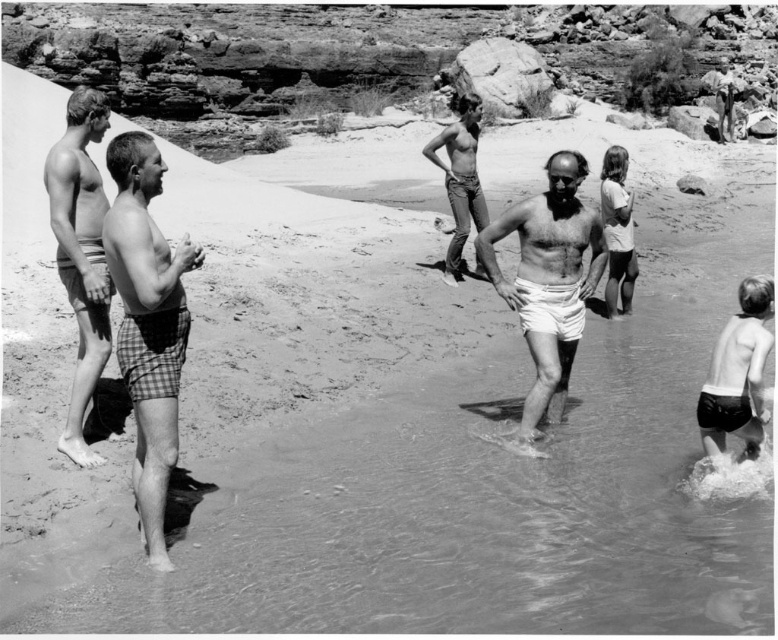
You are standing at the center of the scene and want to find the smooth white shorts at left. In which direction should you look to locate it?

The smooth white shorts at left is located at point (81, 253), which is to the left side of the scene. Look to your left to find it.

Based on the photo, you are a photographer trying to capture a clear shot of both the checkered fabric shorts at left and the white cotton shorts at center. Which one is closer to the camera?

The checkered fabric shorts at left is in front of the white cotton shorts at center, so it is closer to the camera.

You are a photographer standing at the edge of the pool. You want to take a photo that includes both the smooth white shorts at left and the smooth white shirt at upper right. Which object should you focus on first to ensure both are in clear view?

You should focus on the smooth white shorts at left first because it is closer to the viewer than the smooth white shirt at upper right. By focusing on the closer object, the depth of field may help keep both in focus.